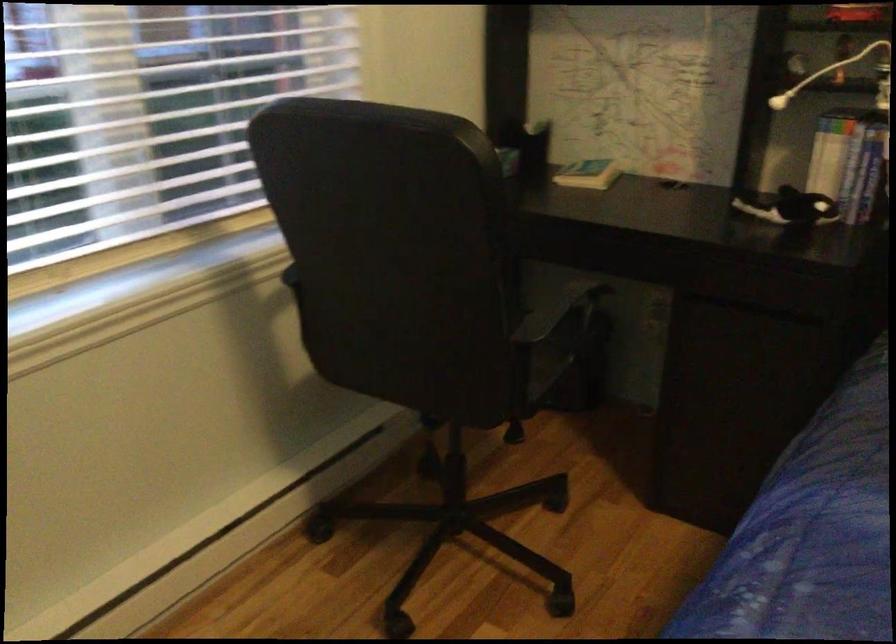
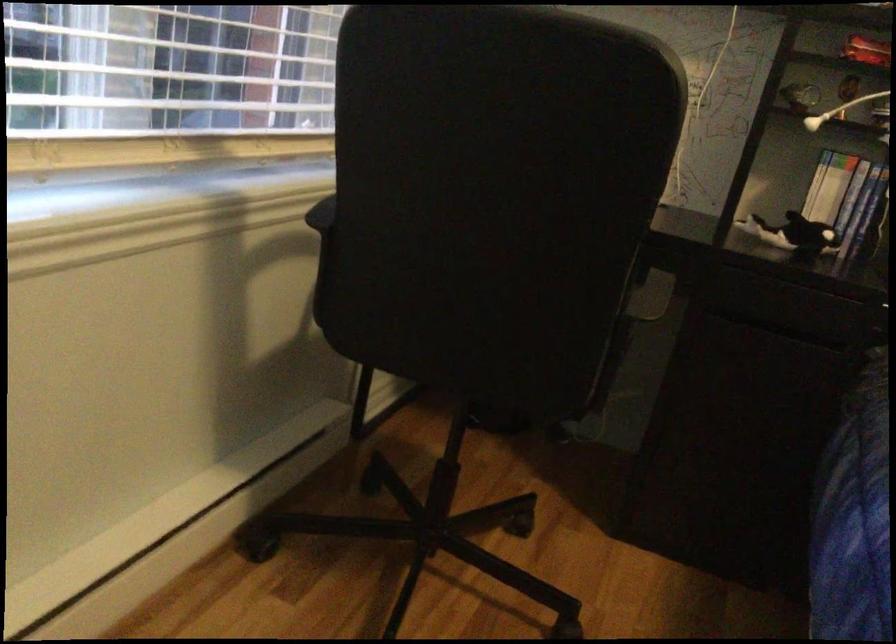
The point at (770, 495) is marked in the first image. Where is the corresponding point in the second image?

(853, 518)